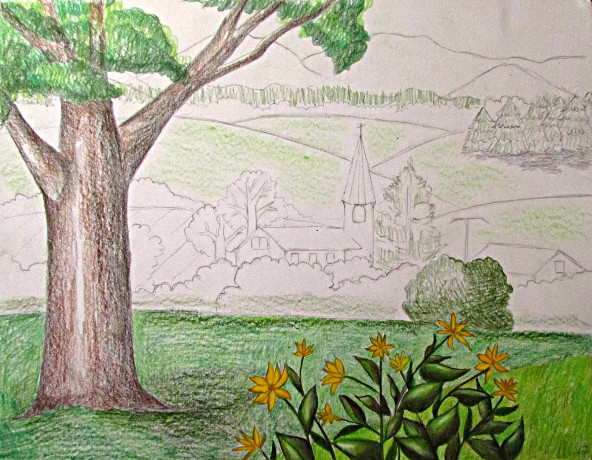
Find the location of `plant`. plant is located at coordinates (402, 418).